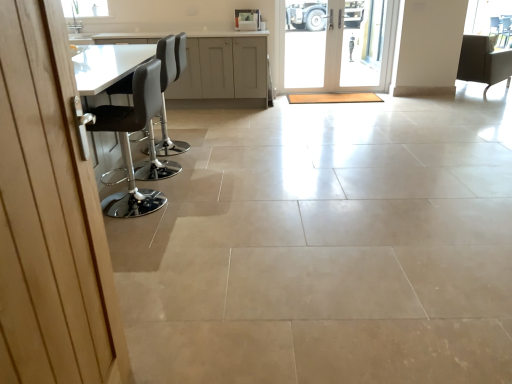
You are a GUI agent. You are given a task and a screenshot of the screen. Output one action in this format:
    pyautogui.click(x=<x>, y=<y>)
    Task: Click on the free point below black leather stool at left, which is the 2th chair in left-to-right order (from a real-world perspective)
    
    Given the screenshot: What is the action you would take?
    pyautogui.click(x=137, y=201)